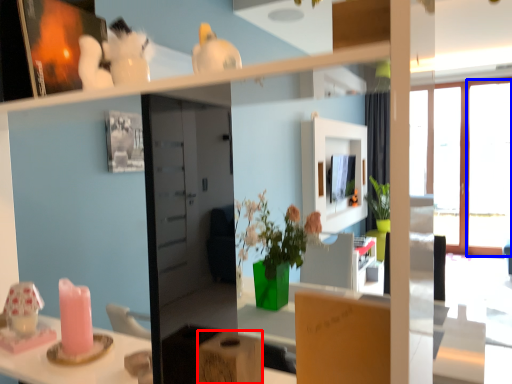
Question: Which of the following is the closest to the observer, cardboard box (highlighted by a red box) or window (highlighted by a blue box)?

Choices:
 (A) cardboard box
 (B) window

Answer: (A)